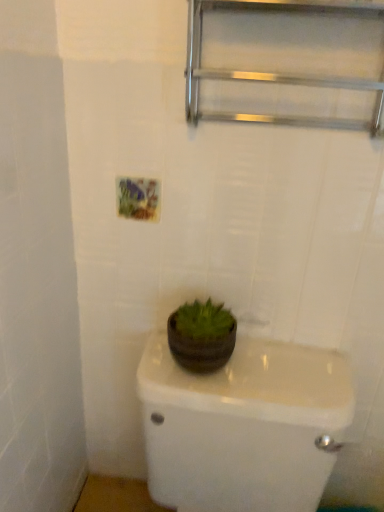
What do you see at coordinates (275, 72) in the screenshot? I see `metallic silver shelf at upper center` at bounding box center [275, 72].

The height and width of the screenshot is (512, 384). Describe the element at coordinates (200, 349) in the screenshot. I see `dark brown matte flowerpot at center` at that location.

Find the location of a particular element. This screenshot has width=384, height=512. dark brown matte flowerpot at center is located at coordinates (200, 349).

Find the location of a particular element. The width and height of the screenshot is (384, 512). matte brown pot at center is located at coordinates (238, 416).

Where is `metallic silver shelf at upper center`? Image resolution: width=384 pixels, height=512 pixels. metallic silver shelf at upper center is located at coordinates (275, 72).

Considering the points (214, 72) and (222, 345), which point is in front, point (214, 72) or point (222, 345)?

Point (214, 72)

Does metallic silver shelf at upper center have a larger size compared to dark brown matte flowerpot at center?

Yes, metallic silver shelf at upper center is bigger than dark brown matte flowerpot at center.

Looking at their sizes, would you say metallic silver shelf at upper center is wider or thinner than dark brown matte flowerpot at center?

Considering their sizes, metallic silver shelf at upper center looks slimmer than dark brown matte flowerpot at center.

Is dark brown matte flowerpot at center completely or partially inside metallic silver shelf at upper center?

No, dark brown matte flowerpot at center is not surrounded by metallic silver shelf at upper center.

Is matte brown pot at center beside dark brown matte flowerpot at center?

They are not placed beside each other.

From a real-world perspective, between matte brown pot at center and dark brown matte flowerpot at center, who is vertically higher?

dark brown matte flowerpot at center.

Is matte brown pot at center thinner than dark brown matte flowerpot at center?

In fact, matte brown pot at center might be wider than dark brown matte flowerpot at center.

Looking at the image, does dark brown matte flowerpot at center seem bigger or smaller compared to metallic silver shelf at upper center?

Considering their sizes, dark brown matte flowerpot at center takes up less space than metallic silver shelf at upper center.

What's the angular difference between dark brown matte flowerpot at center and metallic silver shelf at upper center's facing directions?

dark brown matte flowerpot at center and metallic silver shelf at upper center are facing 0.00561 degrees away from each other.

Image resolution: width=384 pixels, height=512 pixels. Find the location of `shelf located above the dark brown matte flowerpot at center (from a real-world perspective)`. shelf located above the dark brown matte flowerpot at center (from a real-world perspective) is located at coordinates (275, 72).

Is metallic silver shelf at upper center located within dark brown matte flowerpot at center?

No, metallic silver shelf at upper center is not surrounded by dark brown matte flowerpot at center.

Which object is wider, dark brown matte flowerpot at center or matte brown pot at center?

With larger width is matte brown pot at center.

What are the coordinates of `flowerpot above the matte brown pot at center (from a real-world perspective)` in the screenshot? It's located at (200, 349).

Considering the points (185, 358) and (322, 374), which point is behind, point (185, 358) or point (322, 374)?

Positioned behind is point (322, 374).

Is metallic silver shelf at upper center to the right of matte brown pot at center from the viewer's perspective?

Indeed, metallic silver shelf at upper center is positioned on the right side of matte brown pot at center.

Consider the image. From the image's perspective, is metallic silver shelf at upper center above or below matte brown pot at center?

metallic silver shelf at upper center is above matte brown pot at center.

Is metallic silver shelf at upper center positioned with its back to matte brown pot at center?

metallic silver shelf at upper center is not turned away from matte brown pot at center.

In the scene shown: Does metallic silver shelf at upper center have a lesser height compared to matte brown pot at center?

Correct, metallic silver shelf at upper center is not as tall as matte brown pot at center.

Is matte brown pot at center positioned with its back to metallic silver shelf at upper center?

No.

Based on their positions, is matte brown pot at center located to the left or right of metallic silver shelf at upper center?

Based on their positions, matte brown pot at center is located to the left of metallic silver shelf at upper center.

Is matte brown pot at center behind metallic silver shelf at upper center?

No, matte brown pot at center is in front of metallic silver shelf at upper center.

The width and height of the screenshot is (384, 512). What are the coordinates of `shelf that is in front of the dark brown matte flowerpot at center` in the screenshot? It's located at (275, 72).

Locate an element on the screen. The image size is (384, 512). flowerpot above the matte brown pot at center (from the image's perspective) is located at coordinates (200, 349).

When comparing their distances from metallic silver shelf at upper center, does matte brown pot at center or dark brown matte flowerpot at center seem further?

matte brown pot at center lies further to metallic silver shelf at upper center than the other object.

From the image, which object appears to be farther from dark brown matte flowerpot at center, matte brown pot at center or metallic silver shelf at upper center?

The object further to dark brown matte flowerpot at center is metallic silver shelf at upper center.

Considering their positions, is dark brown matte flowerpot at center positioned further to metallic silver shelf at upper center than matte brown pot at center?

matte brown pot at center is positioned further to the anchor metallic silver shelf at upper center.

Considering their positions, is metallic silver shelf at upper center positioned closer to matte brown pot at center than dark brown matte flowerpot at center?

dark brown matte flowerpot at center is closer to matte brown pot at center.

From the image, which object appears to be farther from dark brown matte flowerpot at center, metallic silver shelf at upper center or matte brown pot at center?

metallic silver shelf at upper center is further to dark brown matte flowerpot at center.

From the image, which object appears to be nearer to matte brown pot at center, dark brown matte flowerpot at center or metallic silver shelf at upper center?

dark brown matte flowerpot at center lies closer to matte brown pot at center than the other object.

This screenshot has height=512, width=384. Identify the location of flowerpot between metallic silver shelf at upper center and matte brown pot at center in the vertical direction. (200, 349).